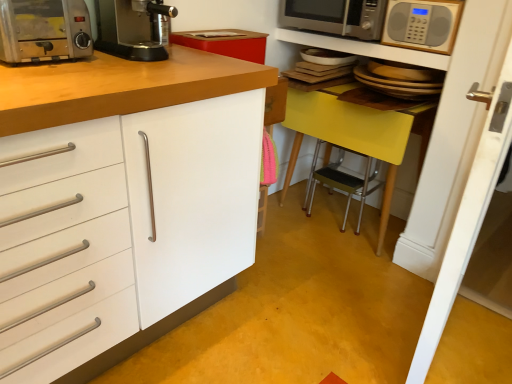
Question: From a real-world perspective, is silver metallic microwave at upper right, marked as the first microwave oven in a front-to-back arrangement, under black plastic coffee machine at upper center?

Choices:
 (A) yes
 (B) no

Answer: (B)

Question: From the image's perspective, is silver metallic microwave at upper right, positioned as the 2th microwave oven in back-to-front order, located beneath black plastic coffee machine at upper center?

Choices:
 (A) no
 (B) yes

Answer: (A)

Question: Does silver metallic microwave at upper right, marked as the first microwave oven in a front-to-back arrangement, have a lesser height compared to black plastic coffee machine at upper center?

Choices:
 (A) yes
 (B) no

Answer: (B)

Question: From the image's perspective, is silver metallic microwave at upper right, marked as the first microwave oven in a front-to-back arrangement, on top of black plastic coffee machine at upper center?

Choices:
 (A) yes
 (B) no

Answer: (A)

Question: Does silver metallic microwave at upper right, marked as the first microwave oven in a front-to-back arrangement, turn towards black plastic coffee machine at upper center?

Choices:
 (A) yes
 (B) no

Answer: (B)

Question: Considering the positions of point 419,0 and point 335,23, is point 419,0 closer or farther from the camera than point 335,23?

Choices:
 (A) closer
 (B) farther

Answer: (A)

Question: Visually, is silver metallic microwave at upper right, positioned as the 2th microwave oven in back-to-front order, positioned to the left or to the right of satin silver microwave at upper right, which appears as the 1th microwave oven when viewed from the back?

Choices:
 (A) right
 (B) left

Answer: (A)

Question: From the image's perspective, is silver metallic microwave at upper right, positioned as the 2th microwave oven in back-to-front order, positioned above or below satin silver microwave at upper right, marked as the second microwave oven in a front-to-back arrangement?

Choices:
 (A) below
 (B) above

Answer: (A)

Question: Is silver metallic microwave at upper right, marked as the first microwave oven in a front-to-back arrangement, inside the boundaries of satin silver microwave at upper right, which appears as the 1th microwave oven when viewed from the back, or outside?

Choices:
 (A) inside
 (B) outside

Answer: (B)

Question: In terms of height, does metallic silver microwave at upper center look taller or shorter compared to black plastic coffee machine at upper center?

Choices:
 (A) short
 (B) tall

Answer: (A)

Question: Considering the positions of point tap(358, 46) and point tap(115, 29), is point tap(358, 46) closer or farther from the camera than point tap(115, 29)?

Choices:
 (A) closer
 (B) farther

Answer: (B)

Question: Considering the positions of metallic silver microwave at upper center and black plastic coffee machine at upper center in the image, is metallic silver microwave at upper center wider or thinner than black plastic coffee machine at upper center?

Choices:
 (A) wide
 (B) thin

Answer: (B)

Question: Considering their positions, is metallic silver microwave at upper center located in front of or behind black plastic coffee machine at upper center?

Choices:
 (A) front
 (B) behind

Answer: (B)

Question: Considering the positions of point (134, 48) and point (357, 51), is point (134, 48) closer or farther from the camera than point (357, 51)?

Choices:
 (A) farther
 (B) closer

Answer: (B)

Question: Is black plastic coffee machine at upper center inside or outside of metallic silver microwave at upper center?

Choices:
 (A) outside
 (B) inside

Answer: (A)